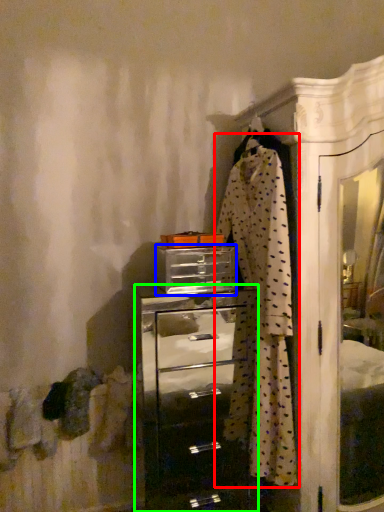
Question: Which object is the closest to the clothing (highlighted by a red box)? Choose among these: drawer (highlighted by a blue box) or chest of drawers (highlighted by a green box).

Choices:
 (A) drawer
 (B) chest of drawers

Answer: (A)